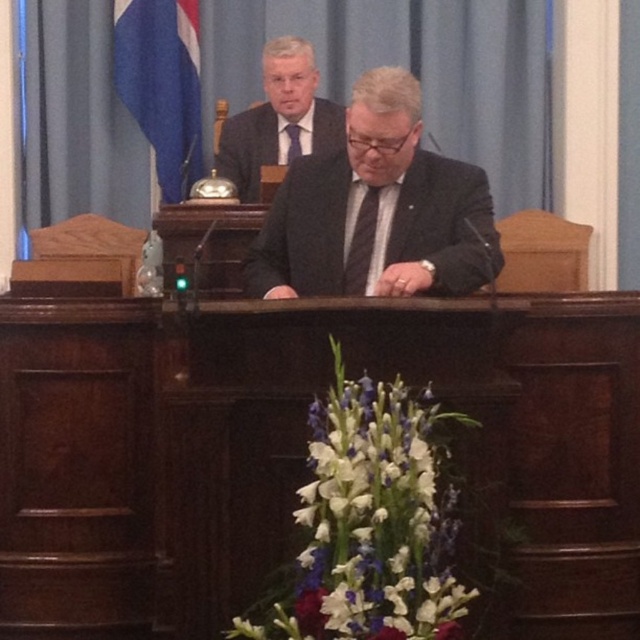
Question: Which is nearer to the satin black suit at upper center?

Choices:
 (A) purple silk tie at center
 (B) black silk tie at center
 (C) blue fabric flag at upper left

Answer: (A)

Question: Which point is closer to the camera taking this photo?

Choices:
 (A) (120, 515)
 (B) (218, 161)
 (C) (120, 64)

Answer: (A)

Question: Can you confirm if dark wood podium at center is positioned below matte black suit at center?

Choices:
 (A) yes
 (B) no

Answer: (A)

Question: Does satin black suit at upper center appear over black silk tie at center?

Choices:
 (A) no
 (B) yes

Answer: (B)

Question: Is black silk tie at center positioned behind purple silk tie at center?

Choices:
 (A) no
 (B) yes

Answer: (A)

Question: Considering the real-world distances, which object is farthest from the black silk tie at center?

Choices:
 (A) satin black suit at upper center
 (B) blue fabric flag at upper left
 (C) matte black suit at center
 (D) dark wood podium at center

Answer: (B)